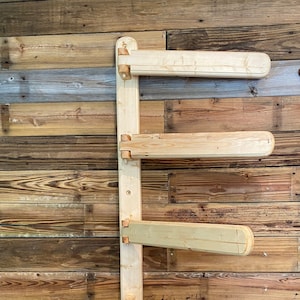
Where is `hinges`? Image resolution: width=300 pixels, height=300 pixels. hinges is located at coordinates (127, 221), (125, 238), (124, 155), (124, 141), (123, 72), (122, 51).